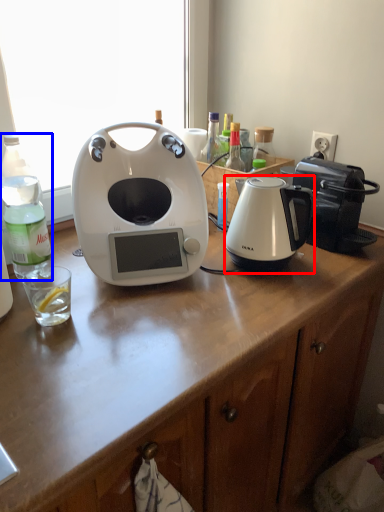
Question: Which of the following is the closest to the observer, kettle (highlighted by a red box) or bottle (highlighted by a blue box)?

Choices:
 (A) kettle
 (B) bottle

Answer: (B)